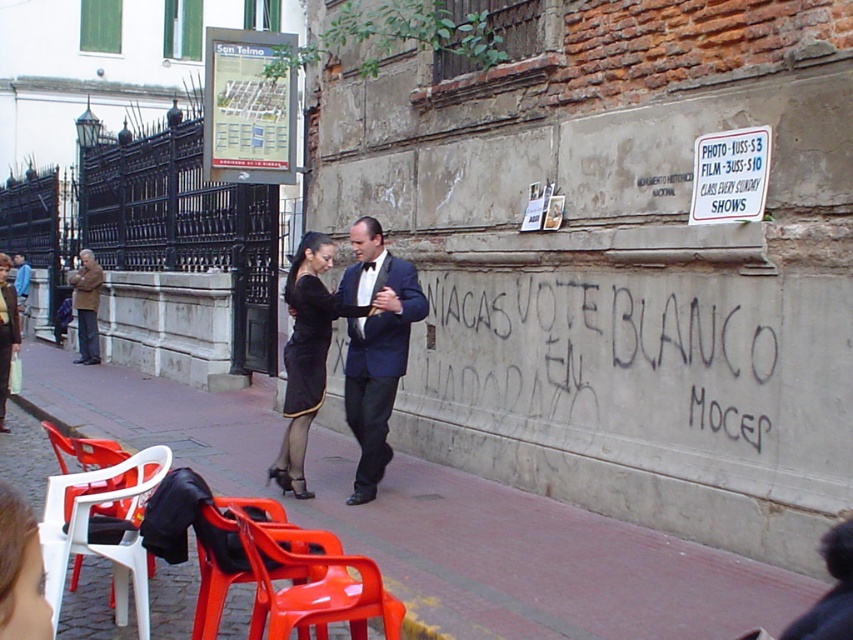
Question: From the image, what is the correct spatial relationship of white plastic chair at lower left in relation to matte black dress at center?

Choices:
 (A) left
 (B) right

Answer: (B)

Question: Can you confirm if black graffiti at center is positioned to the right of white paper sign at upper right?

Choices:
 (A) no
 (B) yes

Answer: (A)

Question: Which object is farther from the camera taking this photo?

Choices:
 (A) matte black dress at center
 (B) shiny dark blue suit at center
 (C) black satin dress at center

Answer: (A)

Question: Which of these objects is positioned closest to the black graffiti at center?

Choices:
 (A) shiny dark blue suit at center
 (B) white plastic chair at lower left

Answer: (A)

Question: Among these objects, which one is nearest to the camera?

Choices:
 (A) matte black dress at center
 (B) brown leather jacket at left

Answer: (A)

Question: Does smooth concrete pavement at center appear on the left side of white paper sign at upper right?

Choices:
 (A) no
 (B) yes

Answer: (B)